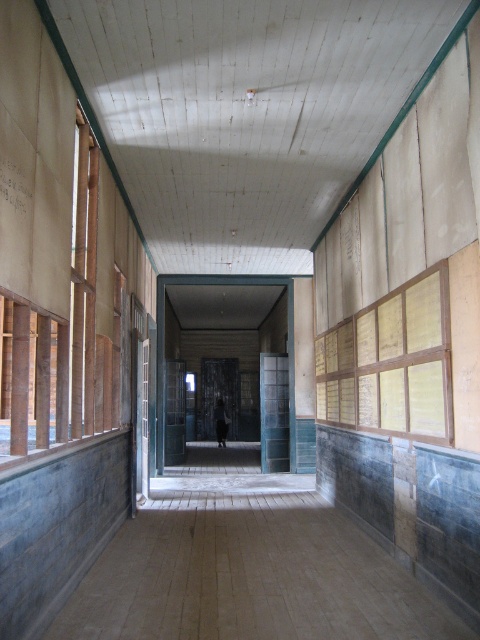
Which is more to the left, wooden paneling at right or white paper at upper left?

Positioned to the left is white paper at upper left.

Is point (432, 385) closer to camera compared to point (24, 179)?

That is False.

Image resolution: width=480 pixels, height=640 pixels. I want to click on wooden paneling at right, so click(x=392, y=364).

Is point (360, 326) positioned after point (220, 445)?

No.

Who is more distant from viewer, (387, 364) or (216, 433)?

The point (216, 433) is more distant.

Who is more forward, (343, 358) or (224, 413)?

Point (343, 358) is more forward.

Where is `wooden paneling at right`? wooden paneling at right is located at coordinates (392, 364).

Who is positioned more to the right, white paper at upper left or dark gray fabric at center?

From the viewer's perspective, dark gray fabric at center appears more on the right side.

Is point (7, 184) closer to viewer compared to point (225, 428)?

Yes, point (7, 184) is closer to viewer.

Locate an element on the screen. white paper at upper left is located at coordinates (17, 180).